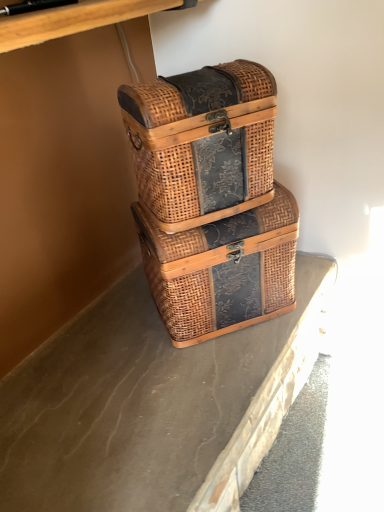
At what (x,y) coordinates should I click in order to perform the action: click on free location above brown textured concrete at center (from a real-world perspective). Please return your answer as a coordinate pair (x, y). This screenshot has height=512, width=384. Looking at the image, I should click on (130, 384).